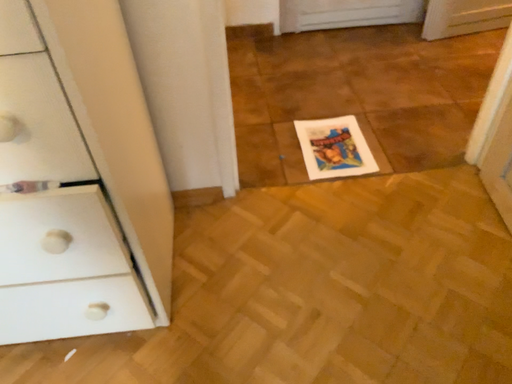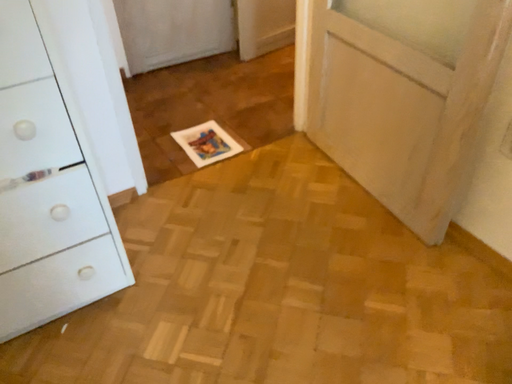
Question: How did the camera likely rotate when shooting the video?

Choices:
 (A) rotated upward
 (B) rotated downward

Answer: (A)